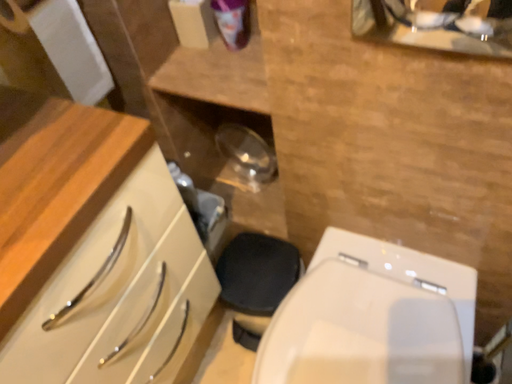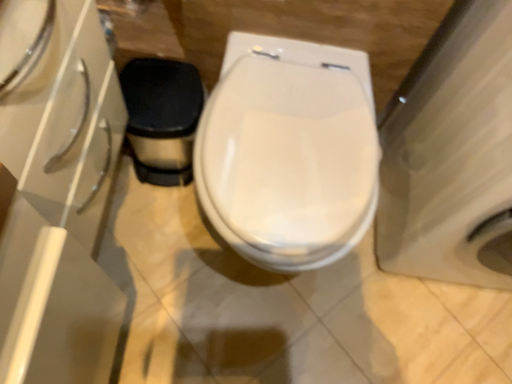
Question: Which way did the camera rotate in the video?

Choices:
 (A) rotated right
 (B) rotated left

Answer: (A)